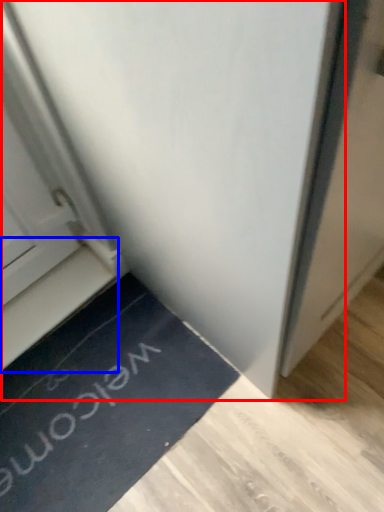
Question: Which object is closer to the camera taking this photo, door (highlighted by a red box) or stairwell (highlighted by a blue box)?

Choices:
 (A) door
 (B) stairwell

Answer: (A)